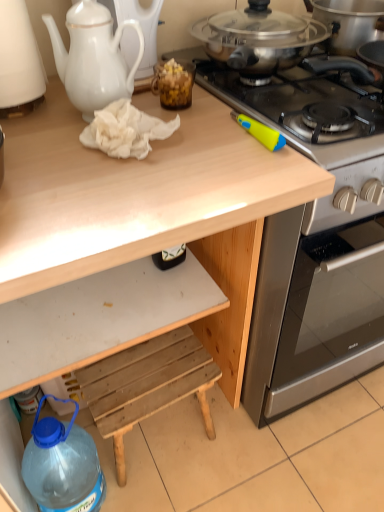
This screenshot has width=384, height=512. Find the location of `vacant space positioned to the left of white porcelain teapot at upper left`. vacant space positioned to the left of white porcelain teapot at upper left is located at coordinates (46, 124).